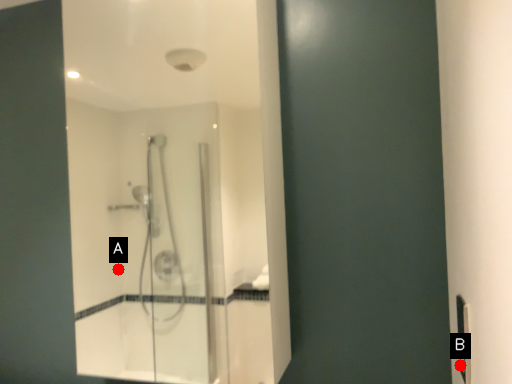
Question: Two points are circled on the image, labeled by A and B beside each circle. Among these points, which one is farthest from the camera?

Choices:
 (A) A is further
 (B) B is further

Answer: (A)